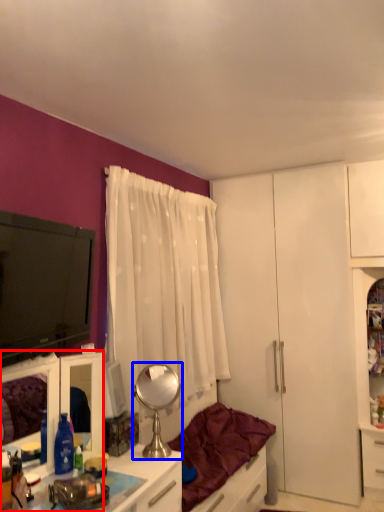
Question: Which object is closer to the camera taking this photo, cabinetry (highlighted by a red box) or mirror (highlighted by a blue box)?

Choices:
 (A) cabinetry
 (B) mirror

Answer: (A)